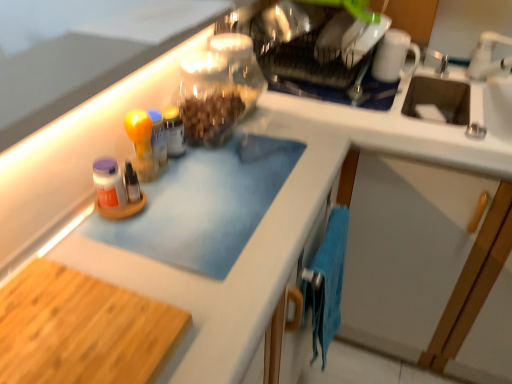
Question: From a real-world perspective, is blue matte cutting board at upper left above or below white ceramic faucet at upper right?

Choices:
 (A) below
 (B) above

Answer: (B)

Question: In the image, is blue matte cutting board at upper left positioned in front of or behind white ceramic faucet at upper right?

Choices:
 (A) behind
 (B) front

Answer: (B)

Question: Based on their relative distances, which object is nearer to the translucent glass jar at center?

Choices:
 (A) blue matte cutting board at upper left
 (B) wooden cutting board at lower left
 (C) white glossy mug at upper right
 (D) blue microfiber towel at lower right
 (E) white ceramic faucet at upper right

Answer: (A)

Question: Which of these objects is positioned closest to the translucent glass jar at center?

Choices:
 (A) white ceramic faucet at upper right
 (B) blue matte cutting board at upper left
 (C) transparent glass jar at upper center
 (D) clear glass jar at upper center
 (E) blue microfiber towel at lower right

Answer: (B)